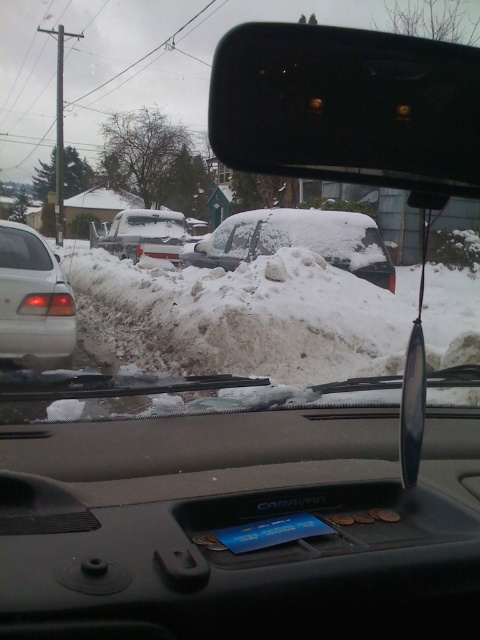
You are a passenger in the car and want to look at the blue card on the black plastic dashboard at center. To do this, you need to shift your gaze from the matte white car window at left. In which direction should you move your eyes?

The black plastic dashboard at center is to the right of the matte white car window at left, so you should move your eyes to the right to look at the blue card on the black plastic dashboard at center.